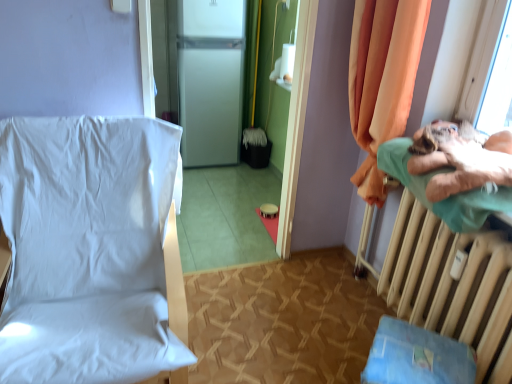
At what (x,y) coordinates should I click in order to perform the action: click on blank space above blue fabric changing table at lower right (from a real-world perspective). Please return your answer as a coordinate pair (x, y). Image resolution: width=512 pixels, height=384 pixels. Looking at the image, I should click on (420, 355).